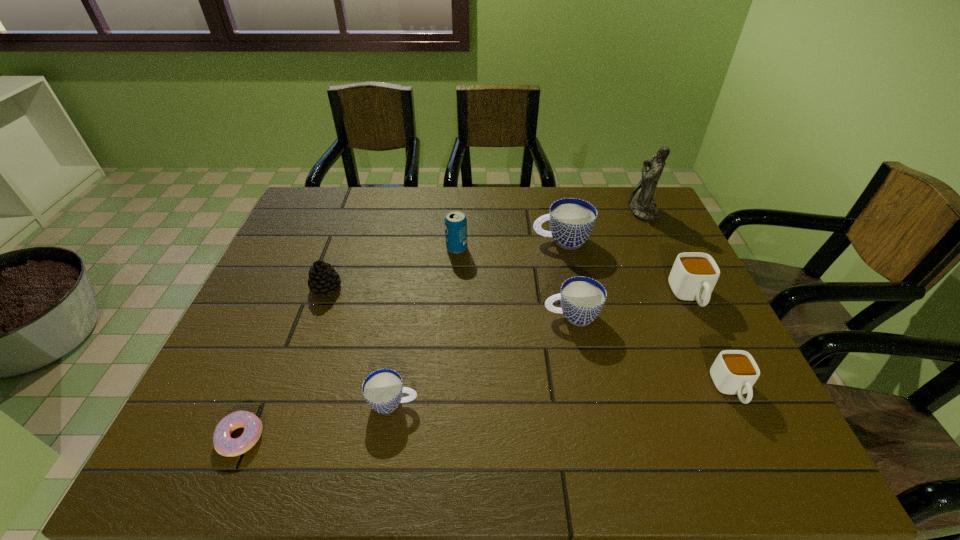
Find the location of a particular element. the nearest blue cup is located at coordinates (383, 389).

The image size is (960, 540). I want to click on the seventh object from right to left, so click(x=383, y=389).

Locate an element on the screen. The height and width of the screenshot is (540, 960). pink doughnut is located at coordinates (226, 446).

Locate an element on the screen. The width and height of the screenshot is (960, 540). doughnut is located at coordinates (226, 446).

In order to click on vacant area situated 0.200m on the front-facing side of the farthest object in this screenshot , I will do `click(568, 211)`.

Where is `vacant space located on the front-facing side of the farthest object`? vacant space located on the front-facing side of the farthest object is located at coordinates (547, 211).

At what (x,y) coordinates should I click in order to perform the action: click on free space located 0.360m on the front-facing side of the farthest object. Please return your answer as a coordinate pair (x, y). The width and height of the screenshot is (960, 540). Looking at the image, I should click on (520, 211).

Where is `vacant point located on the front of the soda can`? The image size is (960, 540). vacant point located on the front of the soda can is located at coordinates (453, 307).

Find the location of `vacant point located on the side of the farthest cup with the handle`. vacant point located on the side of the farthest cup with the handle is located at coordinates (430, 240).

The width and height of the screenshot is (960, 540). What are the coordinates of `vacant space located 0.220m on the side of the farthest cup with the handle` in the screenshot? It's located at (460, 240).